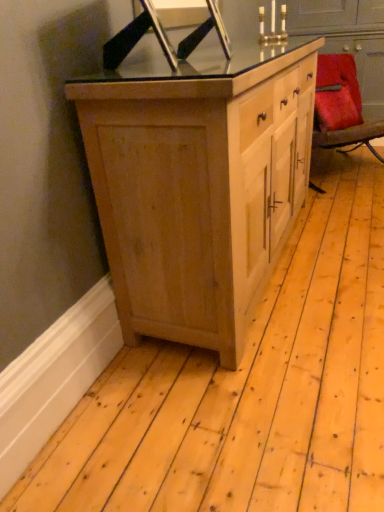
Question: Is point (377, 156) positioned closer to the camera than point (264, 13)?

Choices:
 (A) closer
 (B) farther

Answer: (B)

Question: Considering the positions of velvet red chair at right and metallic gold candle holder at upper center in the image, is velvet red chair at right taller or shorter than metallic gold candle holder at upper center?

Choices:
 (A) short
 (B) tall

Answer: (B)

Question: Which of these objects is positioned farthest from the natural wood cabinet at center?

Choices:
 (A) metallic gold candle holder at upper center
 (B) velvet red chair at right

Answer: (A)

Question: Which is nearer to the metallic gold candle holder at upper center?

Choices:
 (A) natural wood cabinet at center
 (B) velvet red chair at right

Answer: (B)